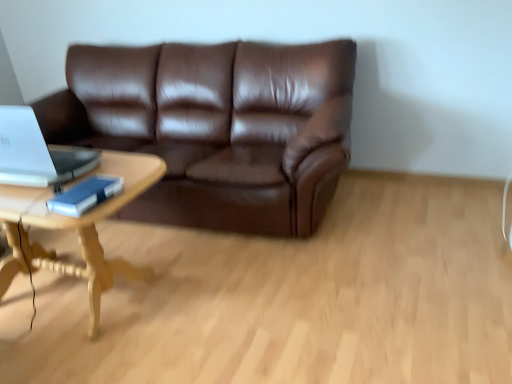
Find the location of `brown leather couch at center`. brown leather couch at center is located at coordinates (217, 127).

In the scene shown: What is the approximate height of brown leather couch at center?

brown leather couch at center is 37.65 inches in height.

What do you see at coordinates (36, 153) in the screenshot?
I see `silver metallic laptop at left` at bounding box center [36, 153].

I want to click on light wood/woodencoffee table at left, so pyautogui.click(x=75, y=228).

Is point (72, 197) positioned behind point (45, 262)?

No, it is in front of (45, 262).

Between blue matte book at left and light wood/woodencoffee table at left, which one has more height?

light wood/woodencoffee table at left.

Is blue matte book at left facing towards light wood/woodencoffee table at left?

No.

Is blue matte book at left to the left or to the right of light wood/woodencoffee table at left in the image?

blue matte book at left is to the right of light wood/woodencoffee table at left.

How many degrees apart are the facing directions of brown leather couch at center and silver metallic laptop at left?

The facing directions of brown leather couch at center and silver metallic laptop at left are 1.77 degrees apart.

Consider the image. Is brown leather couch at center shorter than silver metallic laptop at left?

No, brown leather couch at center is not shorter than silver metallic laptop at left.

Could you tell me if brown leather couch at center is turned towards silver metallic laptop at left?

Yes, brown leather couch at center is turned towards silver metallic laptop at left.

Considering the relative sizes of brown leather couch at center and silver metallic laptop at left in the image provided, is brown leather couch at center smaller than silver metallic laptop at left?

No.

What's the angular difference between silver metallic laptop at left and light wood/woodencoffee table at left's facing directions?

They differ by 0.693 degrees in their facing directions.

From a real-world perspective, is silver metallic laptop at left physically above light wood/woodencoffee table at left?

Yes, from a real-world perspective, silver metallic laptop at left is over light wood/woodencoffee table at left

Which is in front, silver metallic laptop at left or light wood/woodencoffee table at left?

light wood/woodencoffee table at left is in front.

Is silver metallic laptop at left looking in the opposite direction of light wood/woodencoffee table at left?

No, silver metallic laptop at left is not facing away from light wood/woodencoffee table at left.

Can you confirm if silver metallic laptop at left is positioned to the left of blue matte book at left?

Indeed, silver metallic laptop at left is positioned on the left side of blue matte book at left.

Considering the sizes of objects silver metallic laptop at left and blue matte book at left in the image provided, who is thinner, silver metallic laptop at left or blue matte book at left?

blue matte book at left is thinner.

Between silver metallic laptop at left and blue matte book at left, which one has less height?

With less height is blue matte book at left.

Could you tell me if silver metallic laptop at left is facing blue matte book at left?

No, silver metallic laptop at left is not aimed at blue matte book at left.

Considering the relative sizes of blue matte book at left and silver metallic laptop at left in the image provided, is blue matte book at left shorter than silver metallic laptop at left?

Correct, blue matte book at left is not as tall as silver metallic laptop at left.

Which object is positioned more to the right, blue matte book at left or silver metallic laptop at left?

From the viewer's perspective, blue matte book at left appears more on the right side.

Which is closer to the camera, (74, 209) or (44, 157)?

Point (74, 209) is positioned closer to the camera compared to point (44, 157).

From the image's perspective, is blue matte book at left beneath silver metallic laptop at left?

Correct, blue matte book at left appears lower than silver metallic laptop at left in the image.

What's the angular difference between brown leather couch at center and light wood/woodencoffee table at left's facing directions?

The angle between the facing direction of brown leather couch at center and the facing direction of light wood/woodencoffee table at left is 1.08 degrees.

Find the location of a particular element. studio couch lying on the right of light wood/woodencoffee table at left is located at coordinates point(217,127).

In the image, is brown leather couch at center on the left side or the right side of light wood/woodencoffee table at left?

brown leather couch at center is to the right of light wood/woodencoffee table at left.

Is brown leather couch at center surrounded by blue matte book at left?

Actually, brown leather couch at center is outside blue matte book at left.

Is blue matte book at left in front of or behind brown leather couch at center in the image?

blue matte book at left is in front of brown leather couch at center.

Can you confirm if blue matte book at left is shorter than brown leather couch at center?

Yes, blue matte book at left is shorter than brown leather couch at center.

In the image, is blue matte book at left on the left side or the right side of brown leather couch at center?

In the image, blue matte book at left appears on the left side of brown leather couch at center.

In order to click on coffee table that is below the blue matte book at left (from the image's perspective) in this screenshot , I will do `click(75, 228)`.

The width and height of the screenshot is (512, 384). I want to click on laptop lying in front of the brown leather couch at center, so click(36, 153).

Estimate the real-world distances between objects in this image. Which object is further from light wood/woodencoffee table at left, brown leather couch at center or blue matte book at left?

brown leather couch at center.

Estimate the real-world distances between objects in this image. Which object is closer to silver metallic laptop at left, brown leather couch at center or light wood/woodencoffee table at left?

Based on the image, light wood/woodencoffee table at left appears to be nearer to silver metallic laptop at left.

Estimate the real-world distances between objects in this image. Which object is further from light wood/woodencoffee table at left, brown leather couch at center or silver metallic laptop at left?

brown leather couch at center is positioned further to the anchor light wood/woodencoffee table at left.

Estimate the real-world distances between objects in this image. Which object is closer to silver metallic laptop at left, blue matte book at left or brown leather couch at center?

blue matte book at left lies closer to silver metallic laptop at left than the other object.

From the image, which object appears to be nearer to light wood/woodencoffee table at left, silver metallic laptop at left or blue matte book at left?

silver metallic laptop at left is closer to light wood/woodencoffee table at left.

Based on the photo, based on their spatial positions, is light wood/woodencoffee table at left or blue matte book at left further from silver metallic laptop at left?

The object further to silver metallic laptop at left is light wood/woodencoffee table at left.

Based on the photo, estimate the real-world distances between objects in this image. Which object is closer to blue matte book at left, brown leather couch at center or silver metallic laptop at left?

silver metallic laptop at left is closer to blue matte book at left.

Looking at the image, which one is located further to brown leather couch at center, silver metallic laptop at left or light wood/woodencoffee table at left?

Based on the image, silver metallic laptop at left appears to be further to brown leather couch at center.

Locate an element on the screen. book between silver metallic laptop at left and light wood/woodencoffee table at left in the up-down direction is located at coordinates (85, 195).

The width and height of the screenshot is (512, 384). In order to click on laptop between brown leather couch at center and blue matte book at left from top to bottom in this screenshot , I will do `click(36, 153)`.

Identify the location of book between brown leather couch at center and light wood/woodencoffee table at left vertically. (85, 195).

Locate an element on the screen. laptop between brown leather couch at center and light wood/woodencoffee table at left vertically is located at coordinates (36, 153).